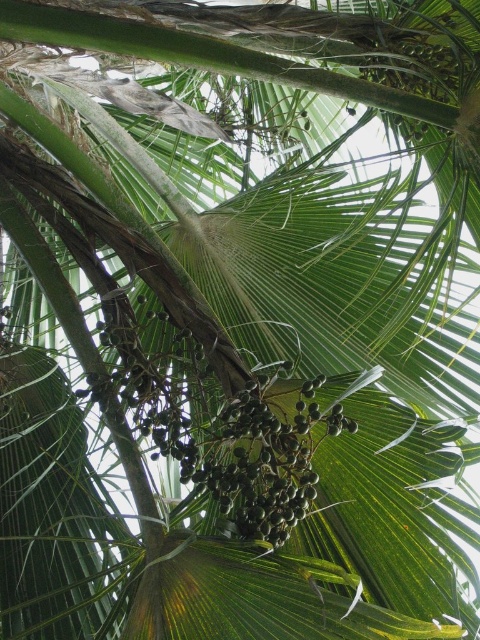
Question: Does green matte fruit at center appear under green matte palm fruit at upper center?

Choices:
 (A) no
 (B) yes

Answer: (B)

Question: Which object appears closest to the camera in this image?

Choices:
 (A) green matte fruit at center
 (B) green matte palm fruit at upper center

Answer: (A)

Question: Can you confirm if green matte fruit at center is positioned above green matte palm fruit at upper center?

Choices:
 (A) yes
 (B) no

Answer: (B)

Question: Which point is closer to the camera?

Choices:
 (A) (428, 92)
 (B) (151, 400)

Answer: (B)

Question: Is green matte fruit at center smaller than green matte palm fruit at upper center?

Choices:
 (A) yes
 (B) no

Answer: (B)